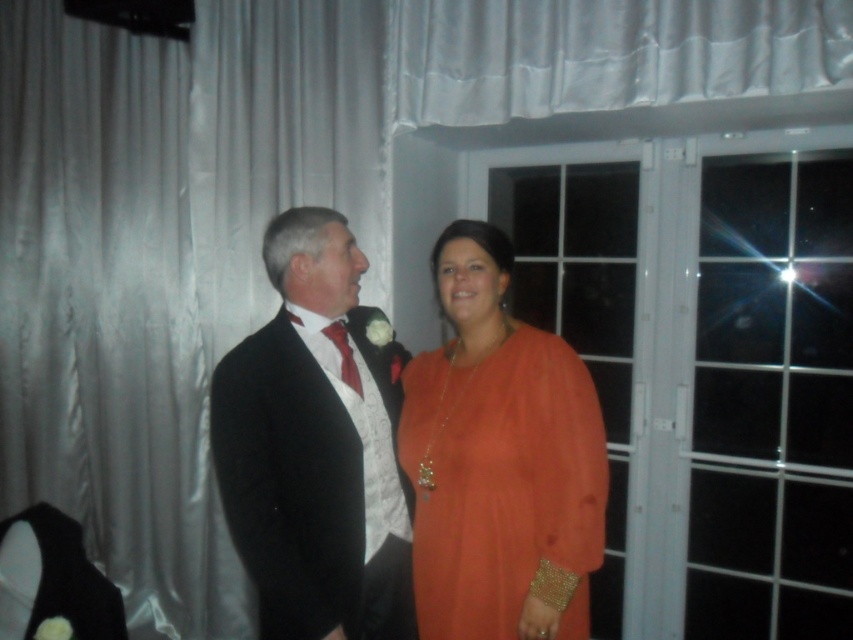
Does orange satin dress at center appear on the right side of shiny black suit at center?

Correct, you'll find orange satin dress at center to the right of shiny black suit at center.

Is orange satin dress at center above shiny black suit at center?

Yes, orange satin dress at center is above shiny black suit at center.

What do you see at coordinates (498, 460) in the screenshot?
I see `orange satin dress at center` at bounding box center [498, 460].

The height and width of the screenshot is (640, 853). In order to click on orange satin dress at center in this screenshot , I will do `click(498, 460)`.

This screenshot has height=640, width=853. In order to click on shiny black suit at center in this screenshot , I will do `click(314, 449)`.

What do you see at coordinates (314, 449) in the screenshot? Image resolution: width=853 pixels, height=640 pixels. I see `shiny black suit at center` at bounding box center [314, 449].

Is point (276, 476) closer to camera compared to point (642, 3)?

Yes, it is.

Image resolution: width=853 pixels, height=640 pixels. In order to click on shiny black suit at center in this screenshot , I will do `click(314, 449)`.

Which is below, silvery satin curtain at left or shiny black suit at center?

shiny black suit at center

Between point (20, 428) and point (311, 307), which one is positioned behind?

The point (20, 428) is behind.

Is point (18, 436) positioned before point (277, 419)?

No, it is behind (277, 419).

The height and width of the screenshot is (640, 853). I want to click on silvery satin curtain at left, so click(x=163, y=260).